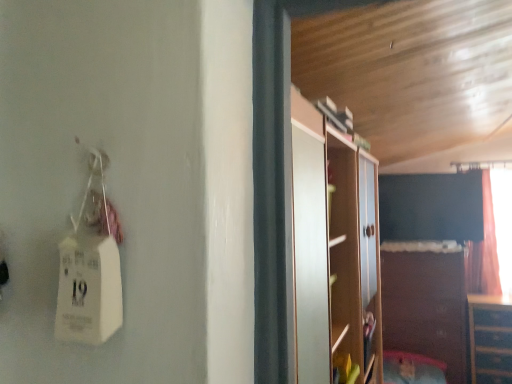
Question: Should I look upward or downward to see brown matte cabinet at lower right, marked as the first cabinetry in a left-to-right arrangement?

Choices:
 (A) down
 (B) up

Answer: (A)

Question: From the image's perspective, is wooden dresser at lower right, which appears as the first cabinetry when viewed from the right, on top of brown matte cabinet at lower right, marked as the first cabinetry in a left-to-right arrangement?

Choices:
 (A) no
 (B) yes

Answer: (A)

Question: Is wooden dresser at lower right, which appears as the first cabinetry when viewed from the right, taller than brown matte cabinet at lower right, marked as the first cabinetry in a left-to-right arrangement?

Choices:
 (A) yes
 (B) no

Answer: (B)

Question: Does wooden dresser at lower right, the second cabinetry when ordered from left to right, have a lesser height compared to brown matte cabinet at lower right, which is the 2th cabinetry from right to left?

Choices:
 (A) yes
 (B) no

Answer: (A)

Question: Does wooden dresser at lower right, the second cabinetry when ordered from left to right, have a greater width compared to brown matte cabinet at lower right, marked as the first cabinetry in a left-to-right arrangement?

Choices:
 (A) no
 (B) yes

Answer: (A)

Question: Is wooden dresser at lower right, which appears as the first cabinetry when viewed from the right, positioned beyond the bounds of brown matte cabinet at lower right, which is the 2th cabinetry from right to left?

Choices:
 (A) yes
 (B) no

Answer: (A)

Question: Considering the relative positions of wooden dresser at lower right, which appears as the first cabinetry when viewed from the right, and brown matte cabinet at lower right, which is the 2th cabinetry from right to left, in the image provided, is wooden dresser at lower right, which appears as the first cabinetry when viewed from the right, behind brown matte cabinet at lower right, which is the 2th cabinetry from right to left,?

Choices:
 (A) yes
 (B) no

Answer: (B)

Question: Does brown matte cabinet at lower right, marked as the first cabinetry in a left-to-right arrangement, have a lesser height compared to wooden dresser at lower right, which appears as the first cabinetry when viewed from the right?

Choices:
 (A) yes
 (B) no

Answer: (B)

Question: Does brown matte cabinet at lower right, marked as the first cabinetry in a left-to-right arrangement, turn towards wooden dresser at lower right, the second cabinetry when ordered from left to right?

Choices:
 (A) yes
 (B) no

Answer: (B)

Question: From the image's perspective, is brown matte cabinet at lower right, marked as the first cabinetry in a left-to-right arrangement, under wooden dresser at lower right, which appears as the first cabinetry when viewed from the right?

Choices:
 (A) no
 (B) yes

Answer: (A)

Question: Is brown matte cabinet at lower right, which is the 2th cabinetry from right to left, turned away from wooden dresser at lower right, which appears as the first cabinetry when viewed from the right?

Choices:
 (A) no
 (B) yes

Answer: (A)

Question: Is brown matte cabinet at lower right, marked as the first cabinetry in a left-to-right arrangement, not close to wooden dresser at lower right, which appears as the first cabinetry when viewed from the right?

Choices:
 (A) no
 (B) yes

Answer: (A)

Question: From a real-world perspective, is brown matte cabinet at lower right, marked as the first cabinetry in a left-to-right arrangement, positioned under wooden dresser at lower right, the second cabinetry when ordered from left to right, based on gravity?

Choices:
 (A) yes
 (B) no

Answer: (B)

Question: Does point (495, 369) appear closer or farther from the camera than point (399, 311)?

Choices:
 (A) farther
 (B) closer

Answer: (B)